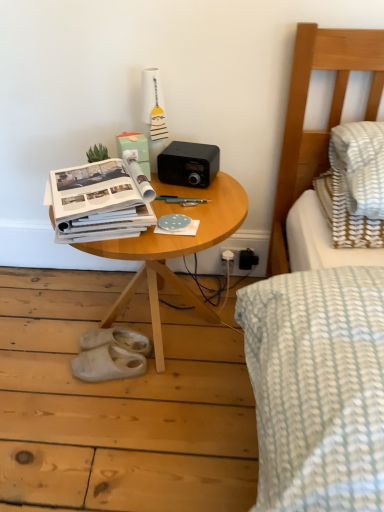
You are a GUI agent. You are given a task and a screenshot of the screen. Output one action in this format:
    pyautogui.click(x=<x>, y=<y>)
    Task: Click on the free location to the right of white paper at center
    
    Given the screenshot: What is the action you would take?
    [202, 221]